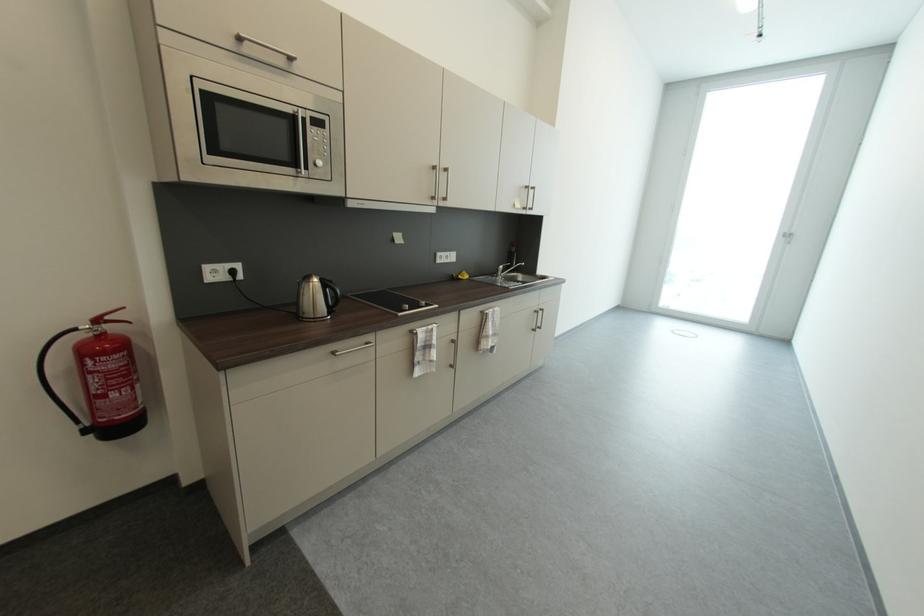
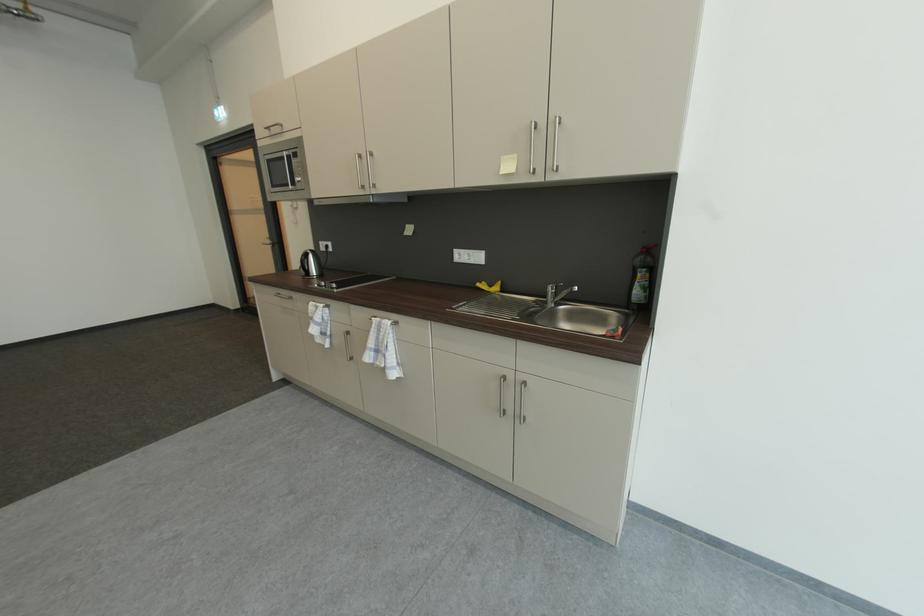
Locate, in the second image, the point that corresponds to [521,246] in the first image.

(650, 252)